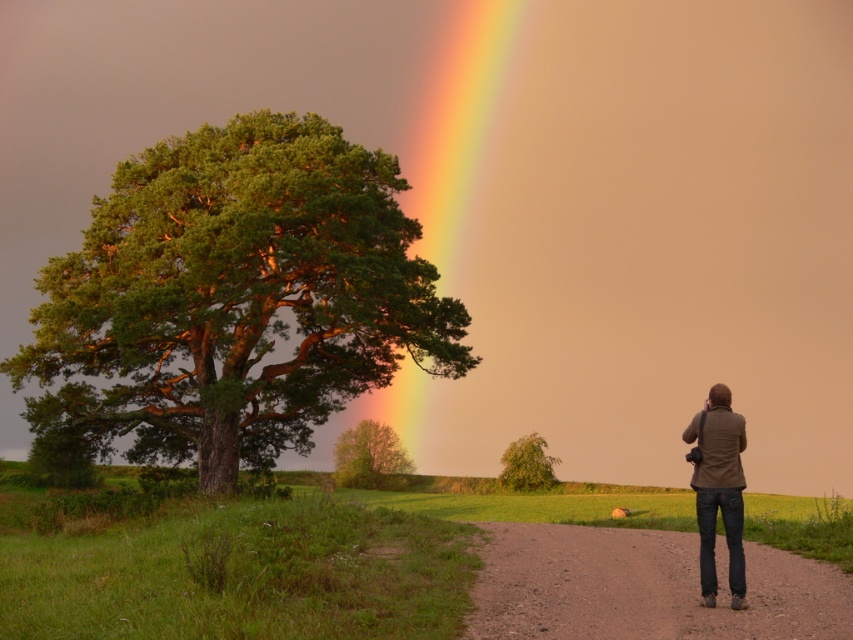
Between green textured tree at left and green leafy tree at center, which one appears on the left side from the viewer's perspective?

green textured tree at left

Is green textured tree at left above green leafy tree at center?

Yes.

Is point (286, 369) positioned before point (387, 445)?

That is True.

Identify the location of green textured tree at left. The height and width of the screenshot is (640, 853). (235, 298).

Which is behind, point (467, 136) or point (540, 483)?

Positioned behind is point (467, 136).

Does rainbow at upper center appear on the left side of green matte tree at center?

Indeed, rainbow at upper center is positioned on the left side of green matte tree at center.

Which is in front, point (410, 433) or point (532, 472)?

Positioned in front is point (532, 472).

This screenshot has height=640, width=853. Find the location of `rainbow at upper center`. rainbow at upper center is located at coordinates (456, 124).

Which is above, green textured tree at left or rainbow at upper center?

rainbow at upper center is higher up.

Is point (173, 321) positioned before point (418, 212)?

Yes, point (173, 321) is in front of point (418, 212).

Locate an element on the screen. The image size is (853, 640). green textured tree at left is located at coordinates (235, 298).